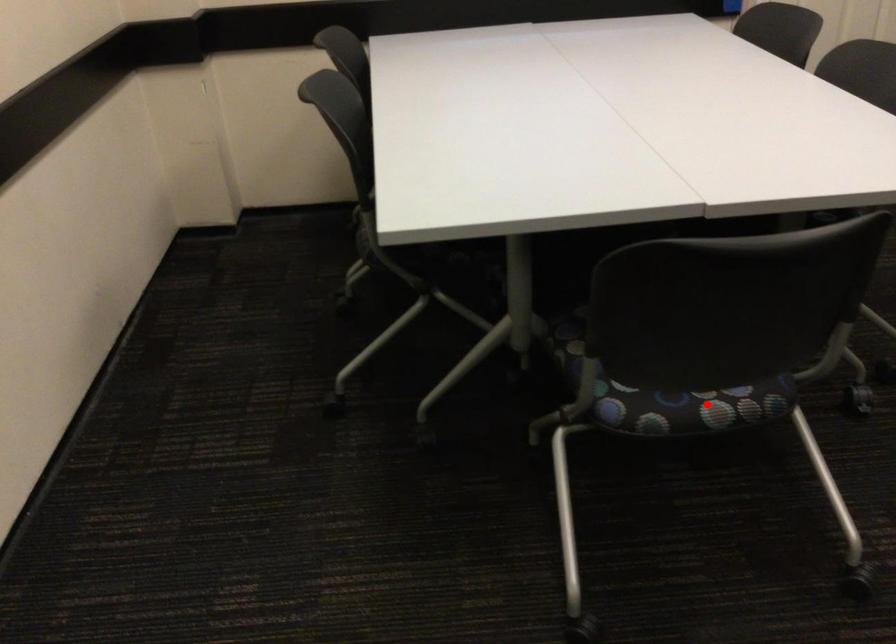
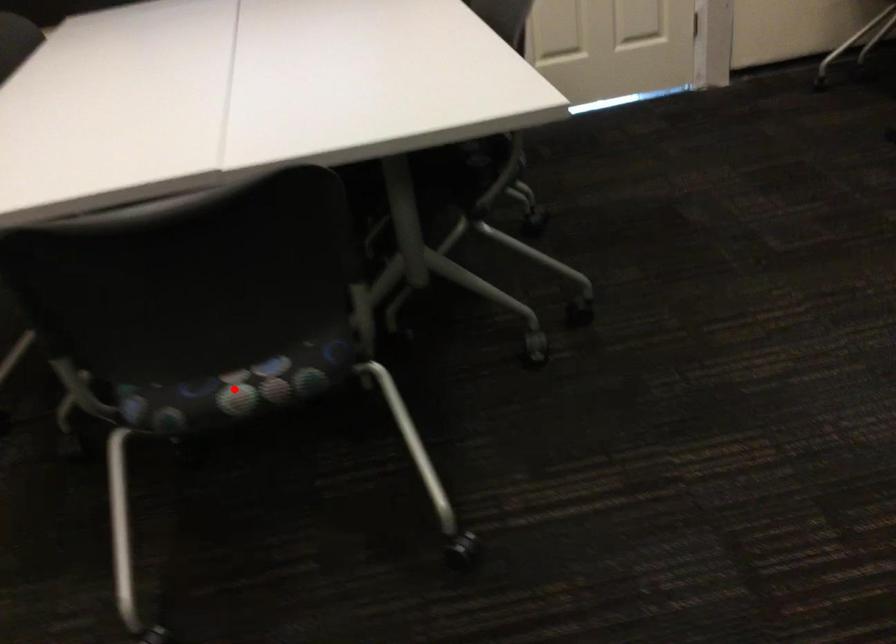
I am providing you with two images of the same scene from different viewpoints. A red point is marked on the first image and another point is marked on the second image. Is the marked point in image1 the same physical position as the marked point in image2?

Yes